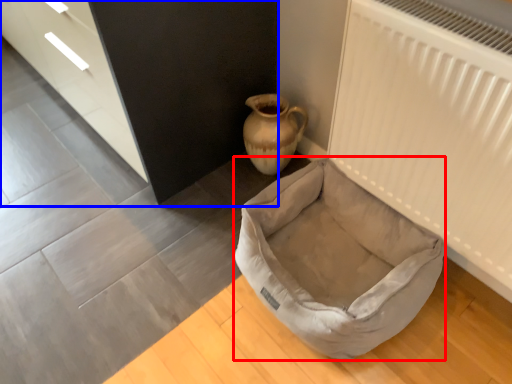
Question: Which object appears farthest to the camera in this image, dog bed (highlighted by a red box) or dresser (highlighted by a blue box)?

Choices:
 (A) dog bed
 (B) dresser

Answer: (B)